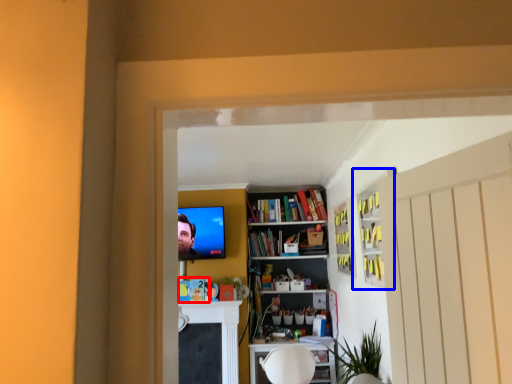
Question: Which point is further to the camera, book (highlighted by a red box) or cabinet (highlighted by a blue box)?

Choices:
 (A) book
 (B) cabinet

Answer: (A)